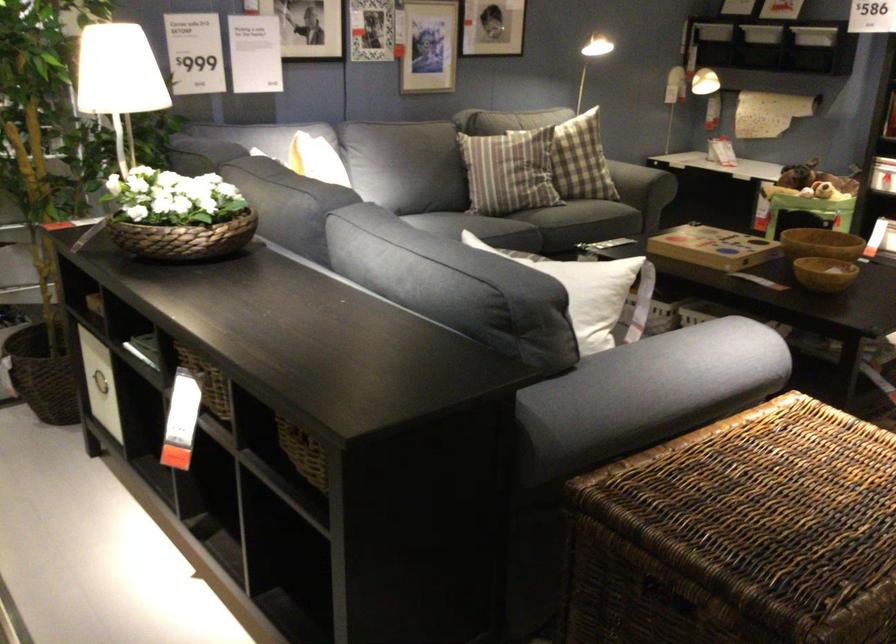
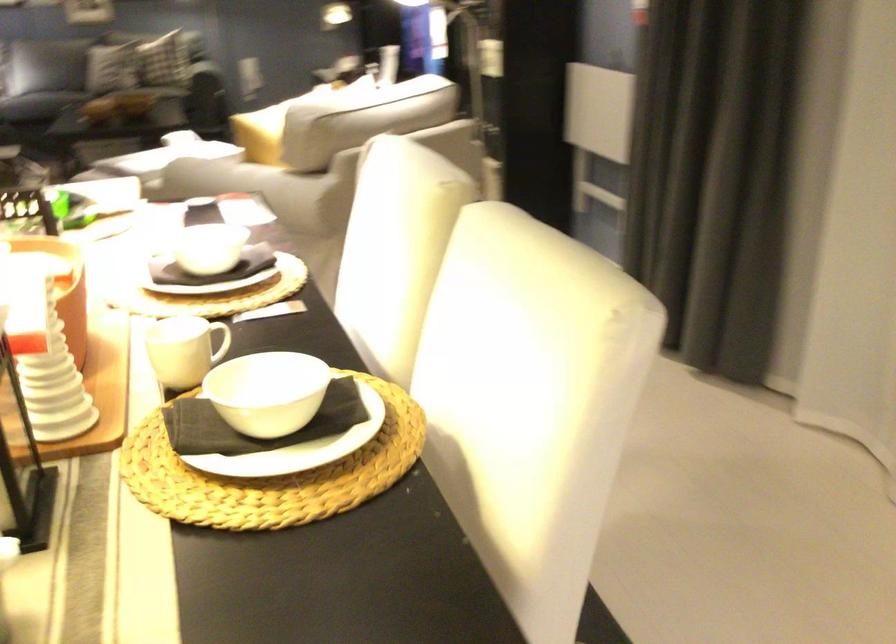
Question: I am providing you with two images of the same scene from different viewpoints. Which of the following objects are not visible in image2?

Choices:
 (A) gold picture frame
 (B) wooden bowl
 (C) sofa armrest
 (D) white plate

Answer: (B)